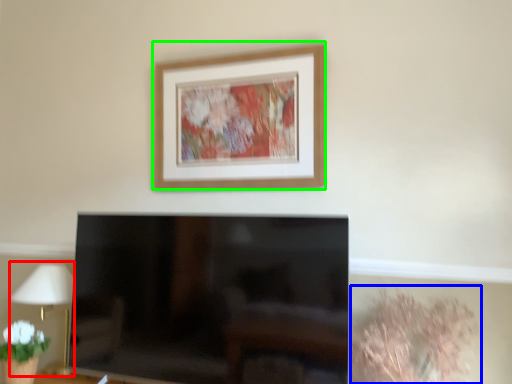
Question: Considering the real-world distances, which object is closest to table lamp (highlighted by a red box)? plant (highlighted by a blue box) or picture frame (highlighted by a green box).

Choices:
 (A) plant
 (B) picture frame

Answer: (B)